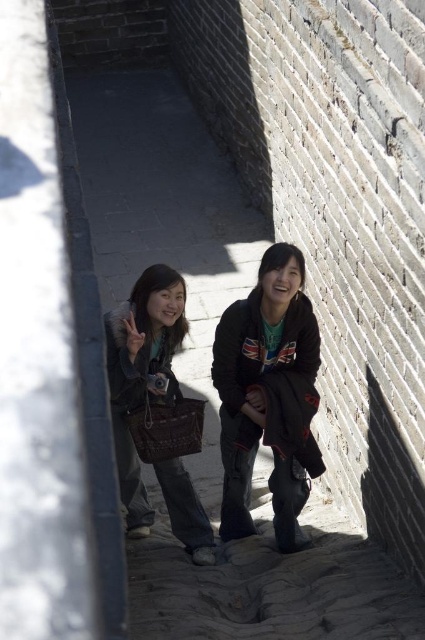
Question: Which point appears closest to the camera in this image?

Choices:
 (A) (300, 412)
 (B) (209, 545)

Answer: (A)

Question: Is dark brown leather jacket at center to the left of matte brown jacket at center from the viewer's perspective?

Choices:
 (A) yes
 (B) no

Answer: (B)

Question: Can you confirm if dark brown leather jacket at center is positioned to the left of matte brown jacket at center?

Choices:
 (A) yes
 (B) no

Answer: (B)

Question: Among these points, which one is farthest from the camera?

Choices:
 (A) [x=118, y=467]
 (B) [x=291, y=269]

Answer: (A)

Question: Does dark brown leather jacket at center appear under matte brown jacket at center?

Choices:
 (A) no
 (B) yes

Answer: (B)